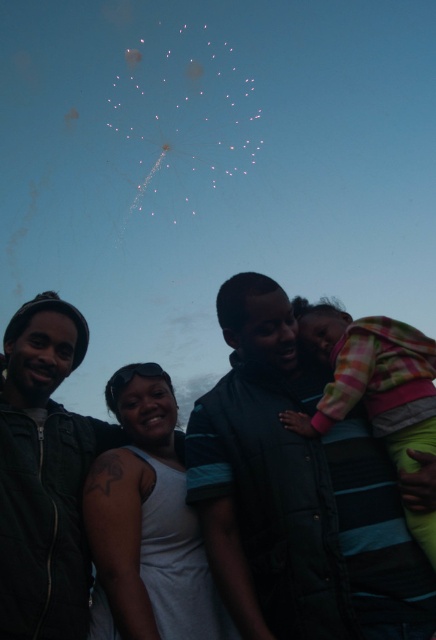
Question: Which of the following is the closest to the observer?

Choices:
 (A) (419, 346)
 (B) (418, 604)
 (C) (65, 476)

Answer: (B)

Question: Is dark green jacket at left below plaid fleece jacket at center?

Choices:
 (A) yes
 (B) no

Answer: (A)

Question: From the image, what is the correct spatial relationship of matte black jacket at center in relation to plaid fleece jacket at center?

Choices:
 (A) above
 (B) below

Answer: (B)

Question: Which point is closer to the camera?

Choices:
 (A) (77, 570)
 (B) (286, 620)

Answer: (B)

Question: Among these points, which one is farthest from the camera?

Choices:
 (A) (218, 529)
 (B) (57, 627)

Answer: (A)

Question: Does matte black jacket at center lie behind dark green jacket at left?

Choices:
 (A) yes
 (B) no

Answer: (B)